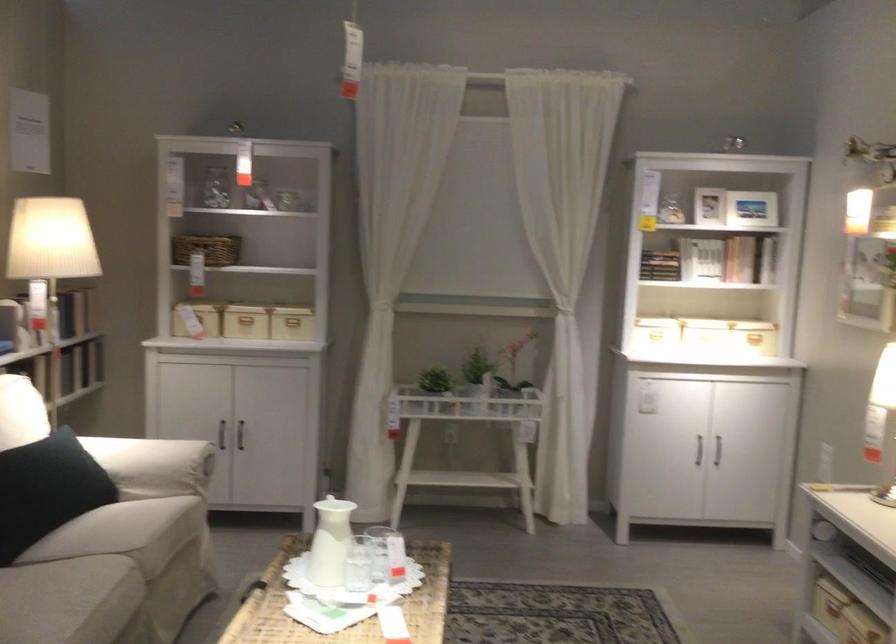
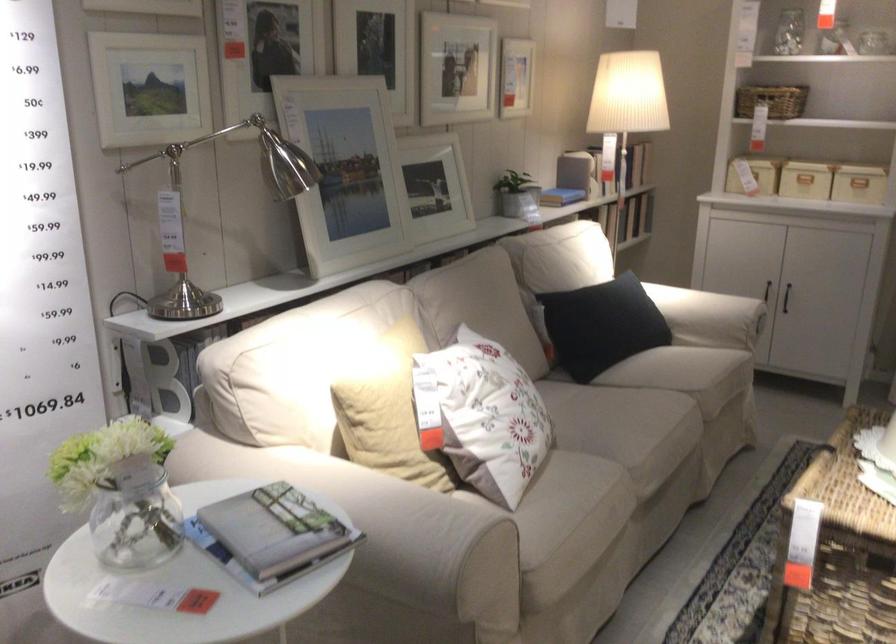
The point at (196, 335) is marked in the first image. Where is the corresponding point in the second image?

(753, 175)